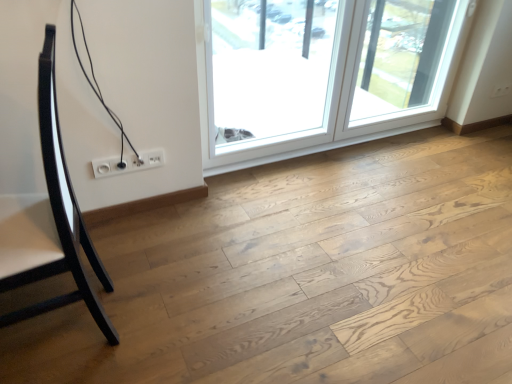
Question: From the image's perspective, is glossy black chair at left positioned above or below transparent glass screen door at upper right?

Choices:
 (A) above
 (B) below

Answer: (B)

Question: Looking at their shapes, would you say glossy black chair at left is wider or thinner than transparent glass screen door at upper right?

Choices:
 (A) wide
 (B) thin

Answer: (A)

Question: Estimate the real-world distances between objects in this image. Which object is closer to the natural wood floor at center?

Choices:
 (A) transparent glass window at upper right, the first window from the right
 (B) glossy black chair at left
 (C) white plastic socket at lower center
 (D) transparent glass screen door at upper right
 (E) transparent glass window at upper center, acting as the 2th window starting from the right

Answer: (B)

Question: Which object is positioned farthest from the natural wood floor at center?

Choices:
 (A) glossy black chair at left
 (B) white plastic socket at lower center
 (C) transparent glass screen door at upper right
 (D) transparent glass window at upper right, the first window from the right
 (E) transparent glass window at upper center, positioned as the first window in left-to-right order

Answer: (C)